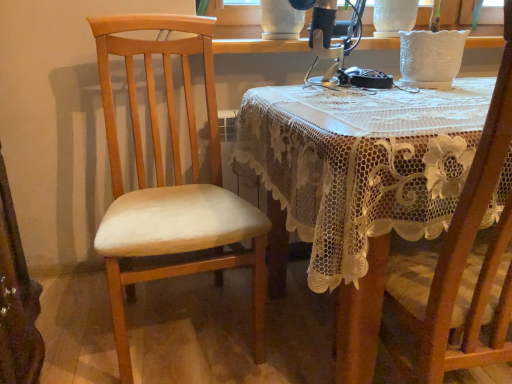
What is the approximate height of lacy fabric table at center?

lacy fabric table at center is 76.53 centimeters in height.

What do you see at coordinates (234, 13) in the screenshot?
I see `white textured vase at upper center` at bounding box center [234, 13].

Find the location of a particular element. The width and height of the screenshot is (512, 384). metallic silver sewing machine at upper center is located at coordinates (330, 38).

Is there a large distance between wooden chair at right, placed as the 2th chair when sorted from left to right, and lacy fabric table at center?

wooden chair at right, placed as the 2th chair when sorted from left to right, is actually quite close to lacy fabric table at center.

Considering the relative sizes of wooden chair at right, arranged as the 1th chair when viewed from the right, and lacy fabric table at center in the image provided, is wooden chair at right, arranged as the 1th chair when viewed from the right, taller than lacy fabric table at center?

Yes.

Is wooden chair at right, arranged as the 1th chair when viewed from the right, aimed at lacy fabric table at center?

Yes, wooden chair at right, arranged as the 1th chair when viewed from the right, is oriented towards lacy fabric table at center.

How distant is white textured vase at upper center from light wood chair at left, the second chair viewed from the right?

white textured vase at upper center and light wood chair at left, the second chair viewed from the right, are 3.87 feet apart from each other.

Identify the location of window screen behind the light wood chair at left, the 1th chair viewed from the left. [x=234, y=13].

Is white textured vase at upper center not inside light wood chair at left, the second chair viewed from the right?

white textured vase at upper center is positioned outside light wood chair at left, the second chair viewed from the right.

From the image's perspective, is white textured vase at upper center located beneath light wood chair at left, the second chair viewed from the right?

No, from the image's perspective, white textured vase at upper center is not below light wood chair at left, the second chair viewed from the right.

From a real-world perspective, is wooden chair at right, arranged as the 1th chair when viewed from the right, over white textured vase at upper center?

Incorrect, from a real-world perspective, wooden chair at right, arranged as the 1th chair when viewed from the right, is lower than white textured vase at upper center.

Is wooden chair at right, placed as the 2th chair when sorted from left to right, next to white textured vase at upper center and touching it?

No.

Is wooden chair at right, arranged as the 1th chair when viewed from the right, thinner than white textured vase at upper center?

No, wooden chair at right, arranged as the 1th chair when viewed from the right, is not thinner than white textured vase at upper center.

Is wooden chair at right, arranged as the 1th chair when viewed from the right, to the right of white textured vase at upper center from the viewer's perspective?

Indeed, wooden chair at right, arranged as the 1th chair when viewed from the right, is positioned on the right side of white textured vase at upper center.

From a real-world perspective, between lacy fabric table at center and light wood chair at left, the second chair viewed from the right, who is vertically higher?

light wood chair at left, the second chair viewed from the right.

Considering the sizes of objects lacy fabric table at center and light wood chair at left, the 1th chair viewed from the left, in the image provided, who is smaller, lacy fabric table at center or light wood chair at left, the 1th chair viewed from the left,?

With smaller size is light wood chair at left, the 1th chair viewed from the left.

Is lacy fabric table at center placed right next to light wood chair at left, the 1th chair viewed from the left?

No, lacy fabric table at center is not next to light wood chair at left, the 1th chair viewed from the left.

From the image's perspective, is lacy fabric table at center above or below light wood chair at left, the second chair viewed from the right?

Based on their image positions, lacy fabric table at center is located beneath light wood chair at left, the second chair viewed from the right.

Consider the image. Can lacy fabric table at center be found inside light wood chair at left, the second chair viewed from the right?

No, lacy fabric table at center is not surrounded by light wood chair at left, the second chair viewed from the right.

Considering the points (183, 26) and (351, 101), which point is in front, point (183, 26) or point (351, 101)?

Point (351, 101)

Which object is thinner, light wood chair at left, the second chair viewed from the right, or lacy fabric table at center?

light wood chair at left, the second chair viewed from the right.

How much distance is there between light wood chair at left, the second chair viewed from the right, and lacy fabric table at center?

A distance of 13.74 inches exists between light wood chair at left, the second chair viewed from the right, and lacy fabric table at center.

Does metallic silver sewing machine at upper center contain lacy fabric table at center?

No, lacy fabric table at center is not surrounded by metallic silver sewing machine at upper center.

Looking at this image, is metallic silver sewing machine at upper center looking in the opposite direction of lacy fabric table at center?

That's not correct — metallic silver sewing machine at upper center is not looking away from lacy fabric table at center.

How different are the orientations of metallic silver sewing machine at upper center and lacy fabric table at center in degrees?

0.326 degrees.

From a real-world perspective, who is located lower, metallic silver sewing machine at upper center or lacy fabric table at center?

In real-world perspective, lacy fabric table at center is lower.

Is light wood chair at left, the 1th chair viewed from the left, thinner than white textured vase at upper center?

In fact, light wood chair at left, the 1th chair viewed from the left, might be wider than white textured vase at upper center.

Which is further, (257, 312) or (234, 7)?

Positioned behind is point (234, 7).

Could you tell me if light wood chair at left, the second chair viewed from the right, is facing white textured vase at upper center?

No, light wood chair at left, the second chair viewed from the right, is not turned towards white textured vase at upper center.

From a real-world perspective, is light wood chair at left, the 1th chair viewed from the left, physically above white textured vase at upper center?

Actually, light wood chair at left, the 1th chair viewed from the left, is physically below white textured vase at upper center in the real world.

From a real-world perspective, which chair is the 1st one above the lacy fabric table at center? Please provide its 2D coordinates.

[(462, 263)]

The image size is (512, 384). In order to click on window screen behind the light wood chair at left, the 1th chair viewed from the left in this screenshot , I will do `click(234, 13)`.

Looking at the image, which one is located further to white textured vase at upper center, wooden chair at right, arranged as the 1th chair when viewed from the right, or metallic silver sewing machine at upper center?

wooden chair at right, arranged as the 1th chair when viewed from the right.

Considering their positions, is lacy fabric table at center positioned closer to white textured vase at upper center than wooden chair at right, placed as the 2th chair when sorted from left to right?

lacy fabric table at center lies closer to white textured vase at upper center than the other object.

Based on their spatial positions, is lacy fabric table at center or metallic silver sewing machine at upper center closer to wooden chair at right, arranged as the 1th chair when viewed from the right?

Among the two, lacy fabric table at center is located nearer to wooden chair at right, arranged as the 1th chair when viewed from the right.

Considering their positions, is wooden chair at right, placed as the 2th chair when sorted from left to right, positioned closer to lacy fabric table at center than white textured vase at upper center?

The object closer to lacy fabric table at center is wooden chair at right, placed as the 2th chair when sorted from left to right.

When comparing their distances from metallic silver sewing machine at upper center, does light wood chair at left, the 1th chair viewed from the left, or lacy fabric table at center seem closer?

Based on the image, lacy fabric table at center appears to be nearer to metallic silver sewing machine at upper center.

Looking at the image, which one is located further to light wood chair at left, the 1th chair viewed from the left, wooden chair at right, arranged as the 1th chair when viewed from the right, or lacy fabric table at center?

wooden chair at right, arranged as the 1th chair when viewed from the right, is positioned further to the anchor light wood chair at left, the 1th chair viewed from the left.

Which object lies further to the anchor point wooden chair at right, placed as the 2th chair when sorted from left to right, metallic silver sewing machine at upper center or white textured vase at upper center?

white textured vase at upper center is further to wooden chair at right, placed as the 2th chair when sorted from left to right.

Estimate the real-world distances between objects in this image. Which object is closer to metallic silver sewing machine at upper center, lacy fabric table at center or wooden chair at right, placed as the 2th chair when sorted from left to right?

Among the two, lacy fabric table at center is located nearer to metallic silver sewing machine at upper center.

Find the location of a particular element. table positioned between wooden chair at right, placed as the 2th chair when sorted from left to right, and white textured vase at upper center from near to far is located at coordinates (360, 183).

Locate an element on the screen. This screenshot has width=512, height=384. sewing machine located between light wood chair at left, the 1th chair viewed from the left, and white textured vase at upper center in the depth direction is located at coordinates (330, 38).

Locate an element on the screen. sewing machine between light wood chair at left, the 1th chair viewed from the left, and lacy fabric table at center, in the horizontal direction is located at coordinates (330, 38).

I want to click on chair located between light wood chair at left, the second chair viewed from the right, and lacy fabric table at center in the left-right direction, so click(462, 263).